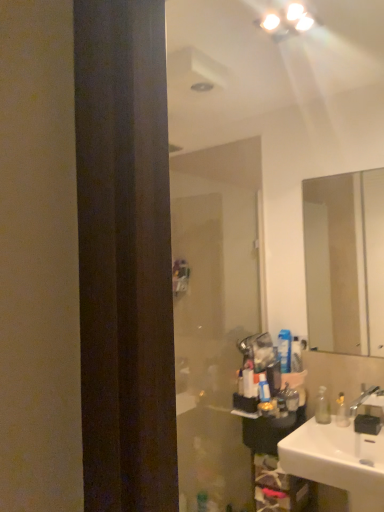
Question: Considering the relative sizes of clear glass mirror at upper right and white glossy toothpaste tube at upper right, which ranks as the second toiletry in back-to-front order, in the image provided, is clear glass mirror at upper right bigger than white glossy toothpaste tube at upper right, which ranks as the second toiletry in back-to-front order,?

Choices:
 (A) no
 (B) yes

Answer: (B)

Question: Is the position of clear glass mirror at upper right more distant than that of white glossy toothpaste tube at upper right, marked as the 2th toiletry in a front-to-back arrangement?

Choices:
 (A) yes
 (B) no

Answer: (B)

Question: Considering the relative sizes of clear glass mirror at upper right and white glossy toothpaste tube at upper right, which appears as the 3th toiletry when viewed from the left, in the image provided, is clear glass mirror at upper right thinner than white glossy toothpaste tube at upper right, which appears as the 3th toiletry when viewed from the left,?

Choices:
 (A) no
 (B) yes

Answer: (B)

Question: Is clear glass mirror at upper right positioned far away from white glossy toothpaste tube at upper right, marked as the 2th toiletry in a front-to-back arrangement?

Choices:
 (A) no
 (B) yes

Answer: (B)

Question: Does clear glass mirror at upper right have a greater height compared to white glossy toothpaste tube at upper right, which is the 1th toiletry from right to left?

Choices:
 (A) yes
 (B) no

Answer: (A)

Question: From a real-world perspective, is clear glass mirror at upper right below white glossy toothpaste tube at upper right, which ranks as the second toiletry in back-to-front order?

Choices:
 (A) yes
 (B) no

Answer: (B)

Question: Can you confirm if white glossy sink at lower right is wider than white glossy light fixture at upper center?

Choices:
 (A) yes
 (B) no

Answer: (A)

Question: Can you confirm if white glossy sink at lower right is thinner than white glossy light fixture at upper center?

Choices:
 (A) yes
 (B) no

Answer: (B)

Question: From the image's perspective, is white glossy sink at lower right on white glossy light fixture at upper center?

Choices:
 (A) yes
 (B) no

Answer: (B)

Question: Is the position of white glossy sink at lower right less distant than that of white glossy light fixture at upper center?

Choices:
 (A) no
 (B) yes

Answer: (A)

Question: Is white glossy light fixture at upper center a part of white glossy sink at lower right?

Choices:
 (A) no
 (B) yes

Answer: (A)

Question: Does white glossy sink at lower right lie behind white glossy light fixture at upper center?

Choices:
 (A) yes
 (B) no

Answer: (A)

Question: Is silver metallic faucet at lower right at the back of transparent plastic bottle at right?

Choices:
 (A) no
 (B) yes

Answer: (A)